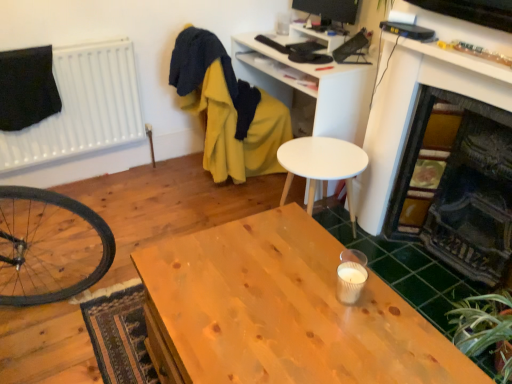
Image resolution: width=512 pixels, height=384 pixels. What do you see at coordinates (287, 310) in the screenshot? I see `wooden table at center` at bounding box center [287, 310].

Describe the element at coordinates (462, 190) in the screenshot. The width and height of the screenshot is (512, 384). I see `dark gray stone fireplace at right` at that location.

At what (x,y) coordinates should I click in order to perform the action: click on black glossy monitor at upper center. Please return your answer as a coordinate pair (x, y). Looking at the image, I should click on (330, 9).

Identify the location of white matte side table at center. (322, 166).

Where is `black matte radiator at upper left`? black matte radiator at upper left is located at coordinates (82, 107).

Does wooden table at center contain black glossy monitor at upper center?

No, black glossy monitor at upper center is not surrounded by wooden table at center.

Is wooden table at center taller or shorter than black glossy monitor at upper center?

In the image, wooden table at center appears to be taller than black glossy monitor at upper center.

Who is bigger, wooden table at center or black glossy monitor at upper center?

wooden table at center.

Which object is thinner, black matte radiator at upper left or wooden table at center?

With smaller width is black matte radiator at upper left.

From a real-world perspective, which object rests below the other?

wooden table at center is physically lower.

Would you say black matte radiator at upper left is inside or outside wooden table at center?

black matte radiator at upper left cannot be found inside wooden table at center.

The image size is (512, 384). Find the location of `desk that appears below the black matte radiator at upper left (from a real-world perspective)`. desk that appears below the black matte radiator at upper left (from a real-world perspective) is located at coordinates (287, 310).

From a real-world perspective, who is located higher, green leafy plant at lower right or wooden table at center?

From a 3D spatial view, wooden table at center is above.

At what (x,y) coordinates should I click in order to perform the action: click on desk below the green leafy plant at lower right (from the image's perspective). Please return your answer as a coordinate pair (x, y). Looking at the image, I should click on (287, 310).

Is wooden table at center a part of green leafy plant at lower right?

That's incorrect, wooden table at center is not inside green leafy plant at lower right.

Which point is more distant from viewer, [463,342] or [260,282]?

The point [463,342] is behind.

Does white matte side table at center have a greater height compared to black fabric at upper left?

Indeed, white matte side table at center has a greater height compared to black fabric at upper left.

In the image, there is a black fabric at upper left. Where is `table below it (from the image's perspective)`? table below it (from the image's perspective) is located at coordinates (322, 166).

From the image's perspective, who appears lower, white matte side table at center or black fabric at upper left?

From the image's view, white matte side table at center is below.

Does point (478, 348) appear closer or farther from the camera than point (473, 164)?

Clearly, point (478, 348) is closer to the camera than point (473, 164).

Can you confirm if green leafy plant at lower right is bigger than dark gray stone fireplace at right?

Actually, green leafy plant at lower right might be smaller than dark gray stone fireplace at right.

Which object is closer to the camera taking this photo, green leafy plant at lower right or dark gray stone fireplace at right?

dark gray stone fireplace at right is more forward.

In the scene shown: Is the surface of green leafy plant at lower right in direct contact with dark gray stone fireplace at right?

No, green leafy plant at lower right is not with dark gray stone fireplace at right.

Between green leafy plant at lower right and black matte radiator at upper left, which one is positioned in front?

green leafy plant at lower right is more forward.

How different are the orientations of green leafy plant at lower right and black matte radiator at upper left in degrees?

The facing directions of green leafy plant at lower right and black matte radiator at upper left are 87.8 degrees apart.

Is black matte radiator at upper left at the back of green leafy plant at lower right?

That's not correct — green leafy plant at lower right is not looking away from black matte radiator at upper left.

Based on the photo, considering the relative sizes of green leafy plant at lower right and black matte radiator at upper left in the image provided, is green leafy plant at lower right wider than black matte radiator at upper left?

Yes.

From a real-world perspective, is wooden table at center under black fabric at upper left?

Yes, from a real-world perspective, wooden table at center is below black fabric at upper left.

Considering the sizes of objects wooden table at center and black fabric at upper left in the image provided, who is taller, wooden table at center or black fabric at upper left?

wooden table at center.

Is wooden table at center to the right of black fabric at upper left from the viewer's perspective?

Yes, wooden table at center is to the right of black fabric at upper left.

The width and height of the screenshot is (512, 384). In order to click on computer monitor on the right of wooden table at center in this screenshot , I will do `click(330, 9)`.

This screenshot has width=512, height=384. In order to click on radiator that is behind the wooden table at center in this screenshot , I will do `click(82, 107)`.

Considering their positions, is black matte radiator at upper left positioned further to black fabric at upper left than dark gray stone fireplace at right?

dark gray stone fireplace at right.

Considering their positions, is black glossy monitor at upper center positioned closer to wooden table at center than green leafy plant at lower right?

Based on the image, green leafy plant at lower right appears to be nearer to wooden table at center.

Looking at the image, which one is located further to green leafy plant at lower right, yellow fabric swivel chair at upper center or black matte radiator at upper left?

black matte radiator at upper left lies further to green leafy plant at lower right than the other object.

Looking at the image, which one is located closer to black matte radiator at upper left, yellow fabric swivel chair at upper center or dark gray stone fireplace at right?

The object closer to black matte radiator at upper left is yellow fabric swivel chair at upper center.

Which object lies further to the anchor point white matte side table at center, black glossy monitor at upper center or wooden table at center?

Based on the image, black glossy monitor at upper center appears to be further to white matte side table at center.

Which object lies further to the anchor point yellow fabric swivel chair at upper center, black matte radiator at upper left or green leafy plant at lower right?

Based on the image, green leafy plant at lower right appears to be further to yellow fabric swivel chair at upper center.

Consider the image. Estimate the real-world distances between objects in this image. Which object is closer to black fabric at upper left, yellow fabric swivel chair at upper center or black matte radiator at upper left?

black matte radiator at upper left lies closer to black fabric at upper left than the other object.

Considering their positions, is black fabric at upper left positioned further to green leafy plant at lower right than wooden table at center?

Based on the image, black fabric at upper left appears to be further to green leafy plant at lower right.

The width and height of the screenshot is (512, 384). What are the coordinates of `plant between black fabric at upper left and dark gray stone fireplace at right from left to right` in the screenshot? It's located at (485, 328).

Where is `plant between black glossy monitor at upper center and wooden table at center from top to bottom`? The width and height of the screenshot is (512, 384). plant between black glossy monitor at upper center and wooden table at center from top to bottom is located at coordinates (485, 328).

Identify the location of radiator between black fabric at upper left and white matte side table at center from left to right. This screenshot has width=512, height=384. (82, 107).

Find the location of `radiator between black fabric at upper left and yellow fabric swivel chair at upper center`. radiator between black fabric at upper left and yellow fabric swivel chair at upper center is located at coordinates (82, 107).